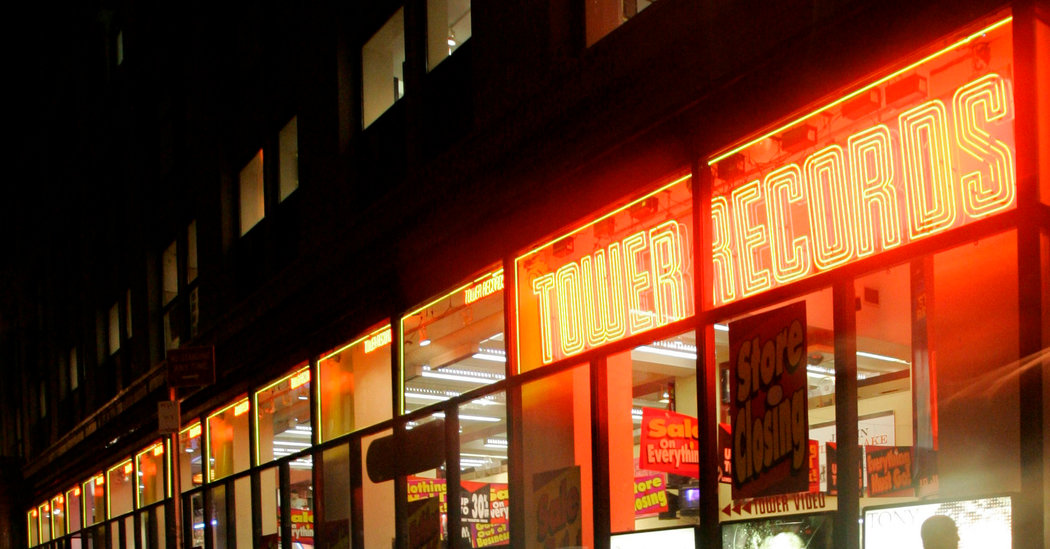
You are a GUI agent. You are given a task and a screenshot of the screen. Output one action in this format:
    pyautogui.click(x=<x>, y=<y>)
    Task: Click on the everything must go sign inside store
    The width and height of the screenshot is (1050, 549).
    Given the screenshot: What is the action you would take?
    pyautogui.click(x=882, y=464)